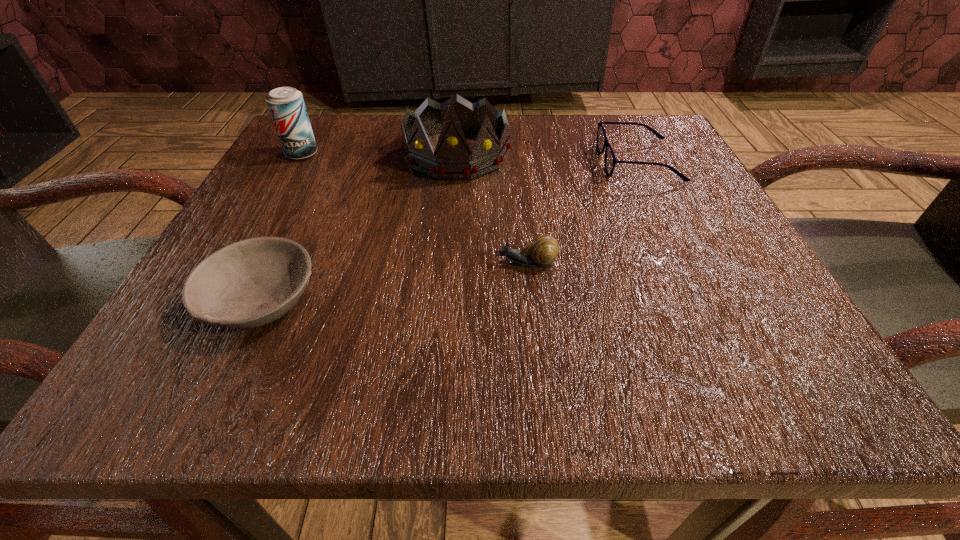
Locate an element on the screen. object located at the right edge is located at coordinates (610, 161).

At what (x,y) coordinates should I click in order to perform the action: click on object that is at the far left corner. Please return your answer as a coordinate pair (x, y). Looking at the image, I should click on (286, 105).

Find the location of a particular element. The width and height of the screenshot is (960, 540). object that is at the near left corner is located at coordinates tap(252, 282).

Identify the location of object positioned at the far right corner. This screenshot has width=960, height=540. (610, 161).

Identify the location of vacant region at the far edge of the desktop. This screenshot has height=540, width=960. (400, 123).

In order to click on vacant area at the near edge in this screenshot , I will do `click(472, 352)`.

The width and height of the screenshot is (960, 540). In the image, there is a desktop. Find the location of `blank space at the left edge`. blank space at the left edge is located at coordinates (302, 218).

The height and width of the screenshot is (540, 960). In the image, there is a desktop. Identify the location of vacant space at the right edge. (731, 312).

Locate an element on the screen. The width and height of the screenshot is (960, 540). free spot at the far left corner of the desktop is located at coordinates (343, 161).

In the image, there is a desktop. Where is `vacant region at the near left corner`? vacant region at the near left corner is located at coordinates (176, 393).